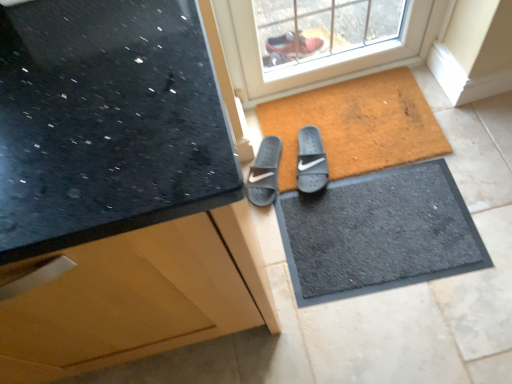
Identify the location of vacant space underneath black rubber doormat at center (from a real-world perspective). (378, 228).